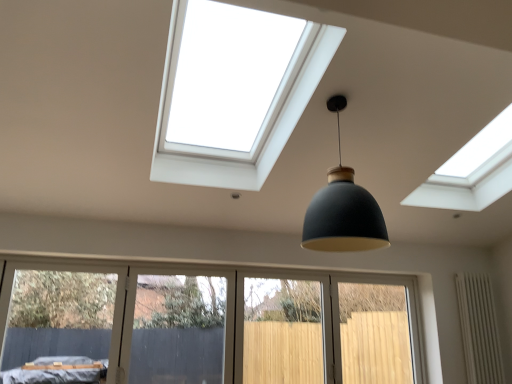
Locate an element on the screen. This screenshot has width=512, height=384. matte black pendant light at center is located at coordinates (343, 209).

The image size is (512, 384). Identify the location of matte black pendant light at center. (343, 209).

Can you confirm if light wood screen door at lower center, which is the 1th screen door in right-to-left order, is taller than white textured radiator at lower right?

Incorrect, the height of light wood screen door at lower center, which is the 1th screen door in right-to-left order, is not larger of that of white textured radiator at lower right.

Is white textured radiator at lower right completely or partially inside light wood screen door at lower center, which is the 1th screen door in right-to-left order?

No.

Which is in front, point (295, 345) or point (466, 372)?

Positioned in front is point (466, 372).

From the image's perspective, between light wood screen door at lower center, which appears as the 2th screen door when viewed from the left, and white textured radiator at lower right, which one is located above?

white textured radiator at lower right appears higher in the image.

Is white textured radiator at lower right taller or shorter than light wood screen door at lower center, which appears as the 2th screen door when viewed from the left?

white textured radiator at lower right is taller than light wood screen door at lower center, which appears as the 2th screen door when viewed from the left.

Is white textured radiator at lower right completely or partially outside of light wood screen door at lower center, which is the 1th screen door in right-to-left order?

Absolutely, white textured radiator at lower right is external to light wood screen door at lower center, which is the 1th screen door in right-to-left order.

Does white textured radiator at lower right have a smaller size compared to light wood screen door at lower center, which is the 1th screen door in right-to-left order?

Yes, white textured radiator at lower right is smaller than light wood screen door at lower center, which is the 1th screen door in right-to-left order.

Looking at their sizes, would you say white textured radiator at lower right is wider or thinner than light wood screen door at lower center, which is the 1th screen door in right-to-left order?

Considering their sizes, white textured radiator at lower right looks broader than light wood screen door at lower center, which is the 1th screen door in right-to-left order.

Measure the distance between matte black pendant light at center and transparent plastic screen door at lower center, which ranks as the first screen door in left-to-right order.

matte black pendant light at center is 8.72 feet from transparent plastic screen door at lower center, which ranks as the first screen door in left-to-right order.

In the scene shown: How different are the orientations of matte black pendant light at center and transparent plastic screen door at lower center, which ranks as the first screen door in left-to-right order, in degrees?

1.07 degrees separate the facing orientations of matte black pendant light at center and transparent plastic screen door at lower center, which ranks as the first screen door in left-to-right order.

Is matte black pendant light at center inside the boundaries of transparent plastic screen door at lower center, which ranks as the 2th screen door in right-to-left order, or outside?

matte black pendant light at center is not inside transparent plastic screen door at lower center, which ranks as the 2th screen door in right-to-left order, it's outside.

Could you tell me if matte black pendant light at center is turned towards transparent plastic screen door at lower center, which ranks as the 2th screen door in right-to-left order?

No, matte black pendant light at center is not facing towards transparent plastic screen door at lower center, which ranks as the 2th screen door in right-to-left order.

Based on their sizes in the image, would you say white textured radiator at lower right is bigger or smaller than transparent plastic screen door at lower center, which ranks as the first screen door in left-to-right order?

In the image, white textured radiator at lower right appears to be smaller than transparent plastic screen door at lower center, which ranks as the first screen door in left-to-right order.

Is the depth of white textured radiator at lower right greater than that of transparent plastic screen door at lower center, which ranks as the first screen door in left-to-right order?

Yes, white textured radiator at lower right is behind transparent plastic screen door at lower center, which ranks as the first screen door in left-to-right order.

Is white textured radiator at lower right far from transparent plastic screen door at lower center, which ranks as the 2th screen door in right-to-left order?

Yes, white textured radiator at lower right is far from transparent plastic screen door at lower center, which ranks as the 2th screen door in right-to-left order.

Is light wood screen door at lower center, which appears as the 2th screen door when viewed from the left, turned away from transparent plastic screen door at lower center, which ranks as the first screen door in left-to-right order?

No, transparent plastic screen door at lower center, which ranks as the first screen door in left-to-right order, is not at the back of light wood screen door at lower center, which appears as the 2th screen door when viewed from the left.

Who is bigger, light wood screen door at lower center, which is the 1th screen door in right-to-left order, or transparent plastic screen door at lower center, which ranks as the 2th screen door in right-to-left order?

light wood screen door at lower center, which is the 1th screen door in right-to-left order, is bigger.

From a real-world perspective, is light wood screen door at lower center, which appears as the 2th screen door when viewed from the left, above or below transparent plastic screen door at lower center, which ranks as the 2th screen door in right-to-left order?

light wood screen door at lower center, which appears as the 2th screen door when viewed from the left, is below transparent plastic screen door at lower center, which ranks as the 2th screen door in right-to-left order.

Considering the sizes of transparent plastic screen door at lower center, which ranks as the first screen door in left-to-right order, and light wood screen door at lower center, which appears as the 2th screen door when viewed from the left, in the image, is transparent plastic screen door at lower center, which ranks as the first screen door in left-to-right order, bigger or smaller than light wood screen door at lower center, which appears as the 2th screen door when viewed from the left,?

In the image, transparent plastic screen door at lower center, which ranks as the first screen door in left-to-right order, appears to be smaller than light wood screen door at lower center, which appears as the 2th screen door when viewed from the left.

Is point (205, 288) positioned behind point (374, 308)?

Yes, it is behind point (374, 308).

Between transparent plastic screen door at lower center, which ranks as the first screen door in left-to-right order, and light wood screen door at lower center, which is the 1th screen door in right-to-left order, which one appears on the left side from the viewer's perspective?

From the viewer's perspective, transparent plastic screen door at lower center, which ranks as the first screen door in left-to-right order, appears more on the left side.

Would you say transparent plastic screen door at lower center, which ranks as the first screen door in left-to-right order, is inside or outside white textured radiator at lower right?

transparent plastic screen door at lower center, which ranks as the first screen door in left-to-right order, is spatially situated outside white textured radiator at lower right.

Is point (219, 351) closer or farther from the camera than point (488, 276)?

Point (219, 351).

Is transparent plastic screen door at lower center, which ranks as the first screen door in left-to-right order, taller than white textured radiator at lower right?

No.

Where is `radiator behind the light wood screen door at lower center, which is the 1th screen door in right-to-left order`? This screenshot has width=512, height=384. radiator behind the light wood screen door at lower center, which is the 1th screen door in right-to-left order is located at coordinates (479, 329).

Identify the location of radiator above the light wood screen door at lower center, which is the 1th screen door in right-to-left order (from a real-world perspective). (479, 329).

From the image, which object appears to be nearer to transparent plastic screen door at lower center, which ranks as the 2th screen door in right-to-left order, matte black pendant light at center or light wood screen door at lower center, which appears as the 2th screen door when viewed from the left?

light wood screen door at lower center, which appears as the 2th screen door when viewed from the left, is closer to transparent plastic screen door at lower center, which ranks as the 2th screen door in right-to-left order.

Which object lies nearer to the anchor point light wood screen door at lower center, which is the 1th screen door in right-to-left order, white textured radiator at lower right or transparent plastic screen door at lower center, which ranks as the first screen door in left-to-right order?

white textured radiator at lower right is positioned closer to the anchor light wood screen door at lower center, which is the 1th screen door in right-to-left order.

Looking at the image, which one is located further to matte black pendant light at center, white textured radiator at lower right or light wood screen door at lower center, which appears as the 2th screen door when viewed from the left?

white textured radiator at lower right.

Based on their spatial positions, is white textured radiator at lower right or matte black pendant light at center further from transparent plastic screen door at lower center, which ranks as the first screen door in left-to-right order?

Based on the image, white textured radiator at lower right appears to be further to transparent plastic screen door at lower center, which ranks as the first screen door in left-to-right order.

Considering their positions, is matte black pendant light at center positioned closer to white textured radiator at lower right than light wood screen door at lower center, which is the 1th screen door in right-to-left order?

Based on the image, light wood screen door at lower center, which is the 1th screen door in right-to-left order, appears to be nearer to white textured radiator at lower right.

Considering their positions, is matte black pendant light at center positioned closer to light wood screen door at lower center, which appears as the 2th screen door when viewed from the left, than transparent plastic screen door at lower center, which ranks as the first screen door in left-to-right order?

The object closer to light wood screen door at lower center, which appears as the 2th screen door when viewed from the left, is transparent plastic screen door at lower center, which ranks as the first screen door in left-to-right order.

Considering their positions, is light wood screen door at lower center, which is the 1th screen door in right-to-left order, positioned further to matte black pendant light at center than white textured radiator at lower right?

Among the two, white textured radiator at lower right is located further to matte black pendant light at center.

Considering their positions, is light wood screen door at lower center, which appears as the 2th screen door when viewed from the left, positioned closer to transparent plastic screen door at lower center, which ranks as the first screen door in left-to-right order, than matte black pendant light at center?

Based on the image, light wood screen door at lower center, which appears as the 2th screen door when viewed from the left, appears to be nearer to transparent plastic screen door at lower center, which ranks as the first screen door in left-to-right order.

In order to click on screen door between matte black pendant light at center and light wood screen door at lower center, which is the 1th screen door in right-to-left order, in the front-back direction in this screenshot , I will do `click(178, 330)`.

I want to click on lamp situated between transparent plastic screen door at lower center, which ranks as the first screen door in left-to-right order, and white textured radiator at lower right from left to right, so click(343, 209).

Find the location of a particular element. screen door between transparent plastic screen door at lower center, which ranks as the first screen door in left-to-right order, and white textured radiator at lower right from left to right is located at coordinates (326, 330).